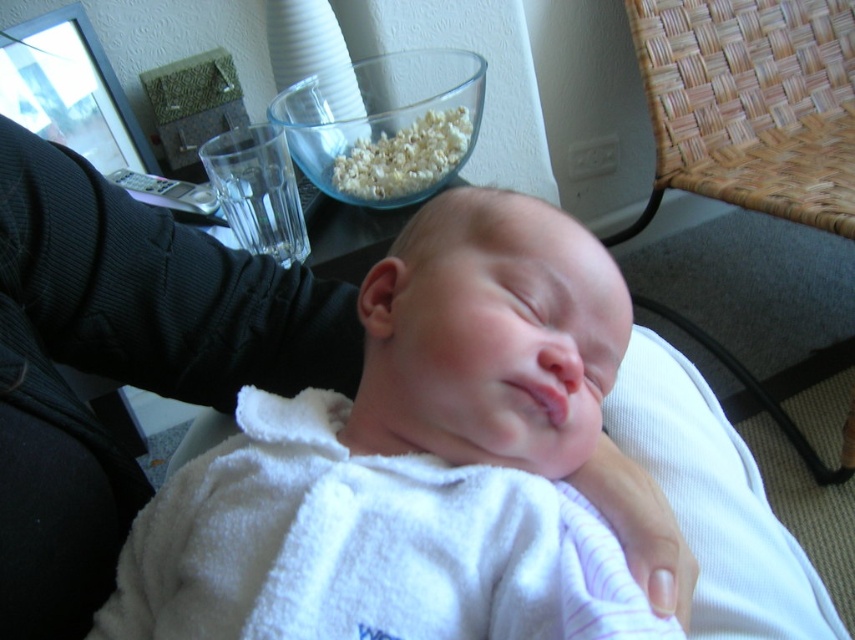
You are a photographer trying to capture the baby in the scene. Since the white soft baby at center and the white fluffy robe at center are both white, how can you ensure the baby stands out in the photo?

The white soft baby at center is smaller than the white fluffy robe at center, so positioning the baby slightly higher or using a different texture or color contrast could help it stand out against the robe.

You are standing in the room and want to reach both the baby and the remote control. The baby is at point (68,324) and the remote control is at point (486,65). Which point should you move towards first to reach them in the shortest path?

You should move towards point (68,324) first because it is closer to you than point (486,65), as point (68,324) is in front of point (486,65).

You are a photographer trying to capture the baby in the scene. You notice two points marked in the image. The first point is at coordinate point (74, 636) and the second is at point (688, 100). Which point is closer to the camera lens?

Point (74, 636) is in front of point (688, 100), so the first point is closer to the camera lens.